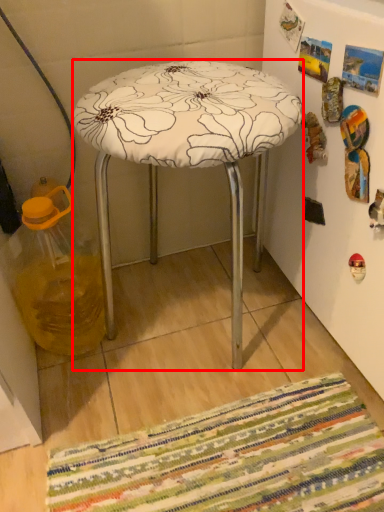
Question: Considering the relative positions of stool (annotated by the red box) and glass jar in the image provided, where is stool (annotated by the red box) located with respect to the staircase?

Choices:
 (A) left
 (B) right

Answer: (B)